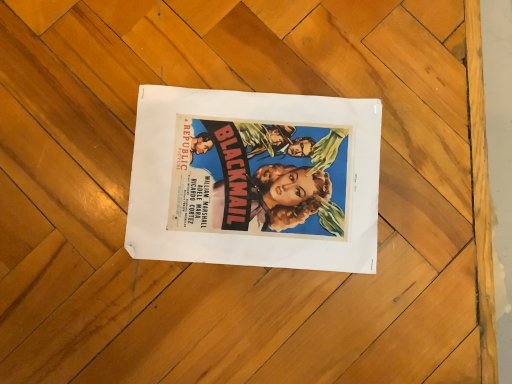
What do you see at coordinates (255, 179) in the screenshot? I see `matte paper poster at center` at bounding box center [255, 179].

Where is `matte paper poster at center`? matte paper poster at center is located at coordinates (255, 179).

What is the approximate height of matte paper poster at center?

0.58 inches.

This screenshot has height=384, width=512. Identify the location of matte paper poster at center. (255, 179).